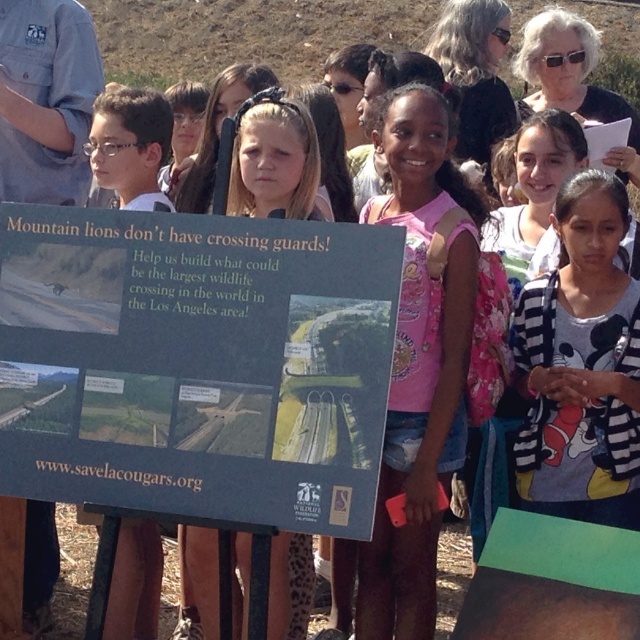
Question: In this image, where is pink fabric shirt at center located relative to white striped sweater at center?

Choices:
 (A) right
 (B) left

Answer: (B)

Question: Among these points, which one is farthest from the camera?

Choices:
 (A) (260, 269)
 (B) (426, 163)

Answer: (B)

Question: Is blue cardboard sign at center bigger than white striped sweater at center?

Choices:
 (A) yes
 (B) no

Answer: (A)

Question: Does pink fabric shirt at center come in front of white striped sweater at center?

Choices:
 (A) no
 (B) yes

Answer: (B)

Question: Which of the following is the farthest from the observer?

Choices:
 (A) white striped sweater at center
 (B) pink fabric shirt at center
 (C) blue cardboard sign at center

Answer: (A)

Question: Estimate the real-world distances between objects in this image. Which object is farther from the blue cardboard sign at center?

Choices:
 (A) white striped sweater at center
 (B) pink fabric shirt at center

Answer: (A)